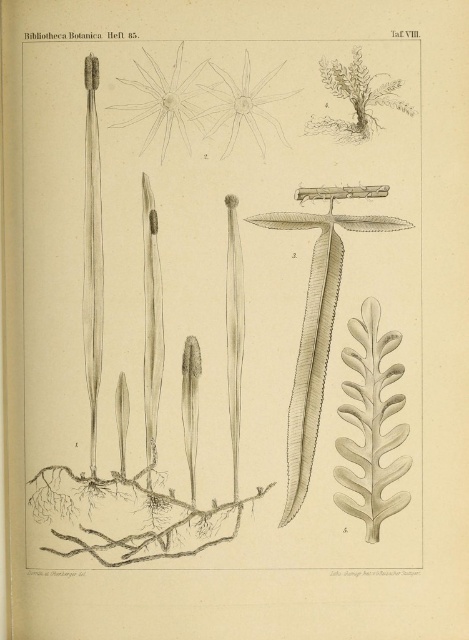
Is the position of gray textured leaf at center right more distant than that of gray-green leafy plant at upper right?

Yes, it is.

Does gray textured leaf at center right have a smaller size compared to gray-green leafy plant at upper right?

Incorrect, gray textured leaf at center right is not smaller in size than gray-green leafy plant at upper right.

The height and width of the screenshot is (640, 469). In order to click on gray textured leaf at center right in this screenshot , I will do `click(370, 424)`.

Can you confirm if gray pencil sketch of plant at center is positioned to the right of gray pencil sketch flower at upper center?

In fact, gray pencil sketch of plant at center is to the left of gray pencil sketch flower at upper center.

Does gray pencil sketch of plant at center have a greater width compared to gray pencil sketch flower at upper center?

Yes.

Which is behind, point (206, 346) or point (255, 104)?

The point (206, 346) is more distant.

Identify the location of gray pencil sketch of plant at center. This screenshot has height=640, width=469. (222, 304).

Is gray pencil sketch of plant at center thinner than white paper flower at upper center?

No.

Locate an element on the screen. The image size is (469, 640). gray pencil sketch of plant at center is located at coordinates coord(222,304).